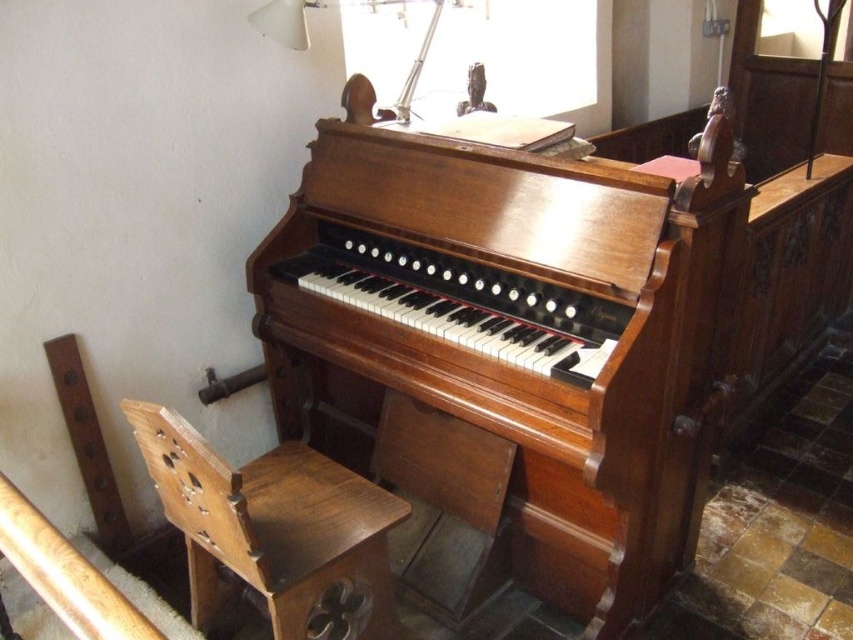
You are a visitor in the church and want to sit down. There is a brown wooden chair at lower left and a white plastic lamp at upper center. Which object is closer to you if you are standing in front of the organ?

The brown wooden chair at lower left is closer to you because it is positioned under the white plastic lamp at upper center, placing it at a lower position.

You are standing in front of the vintage wooden organ and need to reach both the brown wooden chair at lower left and the white plastic lamp at upper center. Which object is nearer to you?

The brown wooden chair at lower left is closer to the viewer than the white plastic lamp at upper center, so the brown wooden chair at lower left is nearer to you.

You are an interior designer planning to place a new table between the brown wooden chair at lower left and the white plastic lamp at upper center. Which object should the table be closer to if it needs to accommodate the larger object?

The table should be closer to the brown wooden chair at lower left because it is larger than the white plastic lamp at upper center.